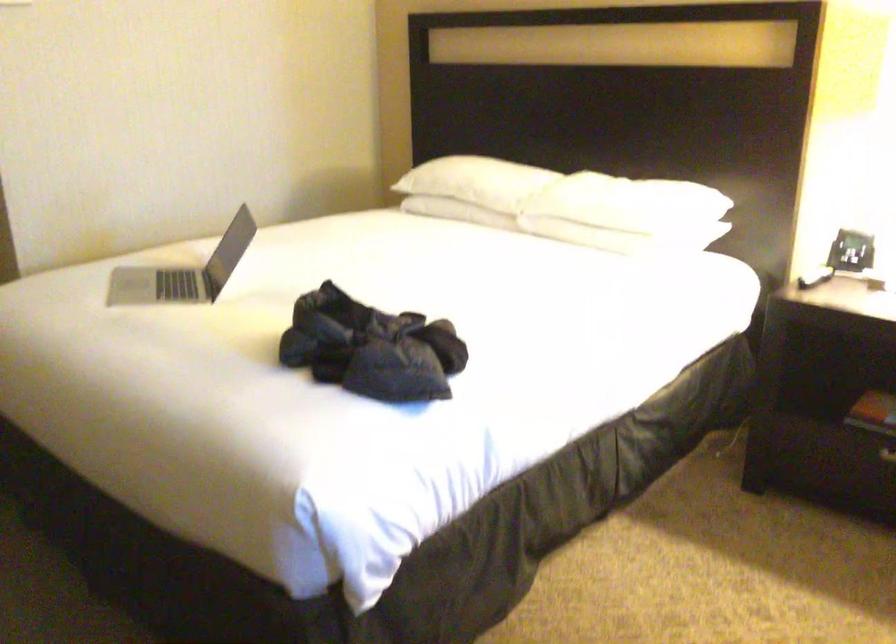
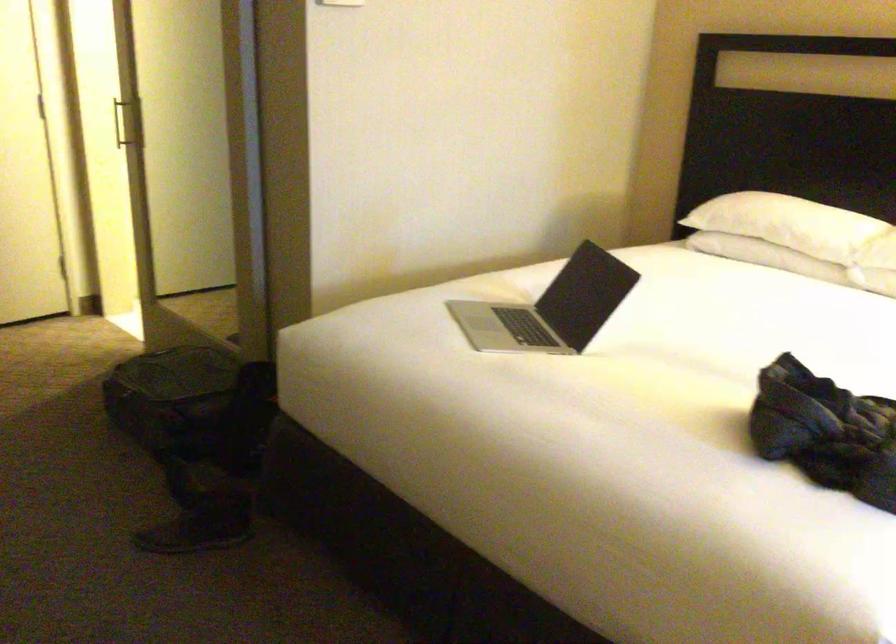
Where in the second image is the point corresponding to (x=463, y=187) from the first image?

(788, 223)